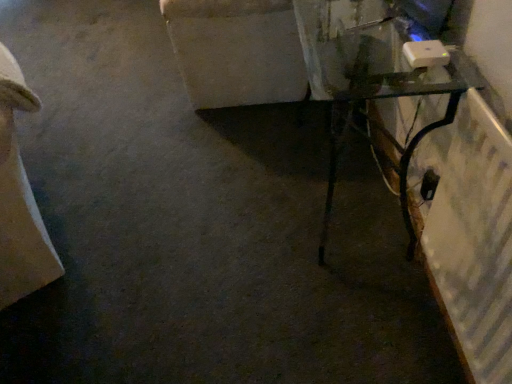
Question: Should I look upward or downward to see transparent glass table at right?

Choices:
 (A) down
 (B) up

Answer: (B)

Question: Is blue glossy monitor at upper right behind beige fabric couch at left?

Choices:
 (A) yes
 (B) no

Answer: (A)

Question: Can you confirm if blue glossy monitor at upper right is bigger than beige fabric couch at left?

Choices:
 (A) no
 (B) yes

Answer: (A)

Question: Considering the relative sizes of blue glossy monitor at upper right and beige fabric couch at left in the image provided, is blue glossy monitor at upper right wider than beige fabric couch at left?

Choices:
 (A) no
 (B) yes

Answer: (A)

Question: From the image's perspective, is blue glossy monitor at upper right under beige fabric couch at left?

Choices:
 (A) no
 (B) yes

Answer: (A)

Question: Can you confirm if blue glossy monitor at upper right is smaller than beige fabric couch at left?

Choices:
 (A) no
 (B) yes

Answer: (B)

Question: Is blue glossy monitor at upper right far away from beige fabric couch at left?

Choices:
 (A) no
 (B) yes

Answer: (B)

Question: Is blue glossy monitor at upper right bigger than transparent glass table at right?

Choices:
 (A) no
 (B) yes

Answer: (A)

Question: Considering the relative sizes of blue glossy monitor at upper right and transparent glass table at right in the image provided, is blue glossy monitor at upper right taller than transparent glass table at right?

Choices:
 (A) yes
 (B) no

Answer: (B)

Question: Does blue glossy monitor at upper right have a lesser height compared to transparent glass table at right?

Choices:
 (A) no
 (B) yes

Answer: (B)

Question: Could you tell me if blue glossy monitor at upper right is facing transparent glass table at right?

Choices:
 (A) no
 (B) yes

Answer: (A)

Question: Is blue glossy monitor at upper right at the right side of transparent glass table at right?

Choices:
 (A) yes
 (B) no

Answer: (A)

Question: Can we say blue glossy monitor at upper right lies outside transparent glass table at right?

Choices:
 (A) no
 (B) yes

Answer: (B)

Question: From the image's perspective, is beige fabric couch at left located above blue glossy monitor at upper right?

Choices:
 (A) no
 (B) yes

Answer: (A)